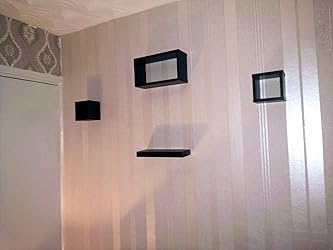
The height and width of the screenshot is (250, 333). I want to click on design above door, so click(20, 52).